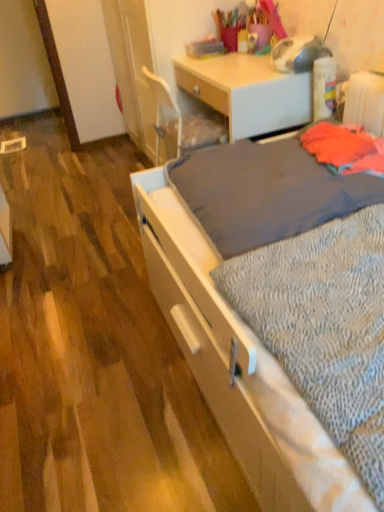
Identify the location of free spot above matte wood desk at center (from a real-world perspective). (229, 61).